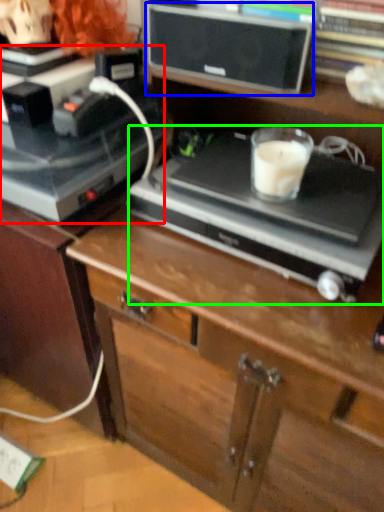
Question: Considering the real-world distances, which object is closest to appliance (highlighted by a red box)? speaker (highlighted by a blue box) or appliance (highlighted by a green box).

Choices:
 (A) speaker
 (B) appliance

Answer: (B)